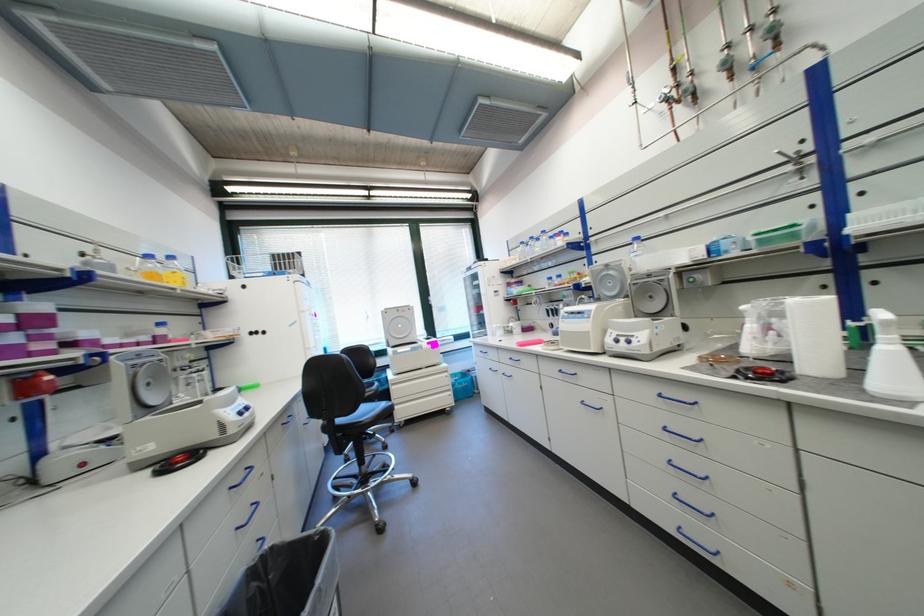
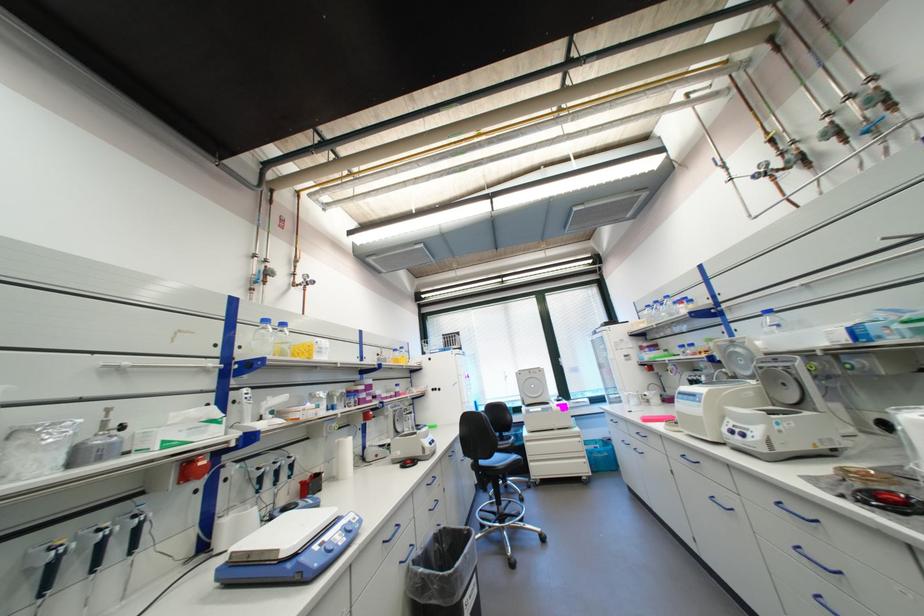
Find the pixel in the second image that matches the point at 670,282 in the first image.

(796, 369)